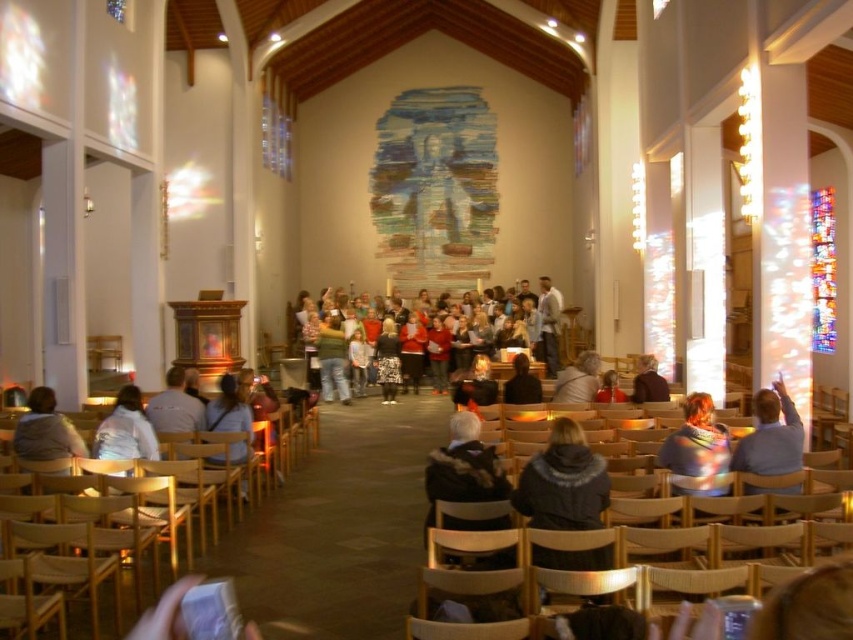
Is multicolored fabric at center shorter than matte brown jacket at lower right?

In fact, multicolored fabric at center may be taller than matte brown jacket at lower right.

Which is in front, point (328, 289) or point (654, 387)?

Point (654, 387)

Where is `multicolored fabric at center`? multicolored fabric at center is located at coordinates (463, 342).

Does multicolored scarf at center have a larger size compared to light gray sweater at lower left?

No, multicolored scarf at center is not bigger than light gray sweater at lower left.

The image size is (853, 640). What do you see at coordinates (697, 449) in the screenshot? I see `multicolored scarf at center` at bounding box center [697, 449].

Is point (717, 474) positioned after point (54, 432)?

No, it is not.

This screenshot has width=853, height=640. Find the location of `multicolored scarf at center`. multicolored scarf at center is located at coordinates (697, 449).

How far apart are multicolored scarf at center and matte brown jacket at lower right?

They are 15.03 meters apart.

Is multicolored scarf at center thinner than matte brown jacket at lower right?

Yes.

The image size is (853, 640). What do you see at coordinates (697, 449) in the screenshot? I see `multicolored scarf at center` at bounding box center [697, 449].

Identify the location of multicolored scarf at center. The image size is (853, 640). (697, 449).